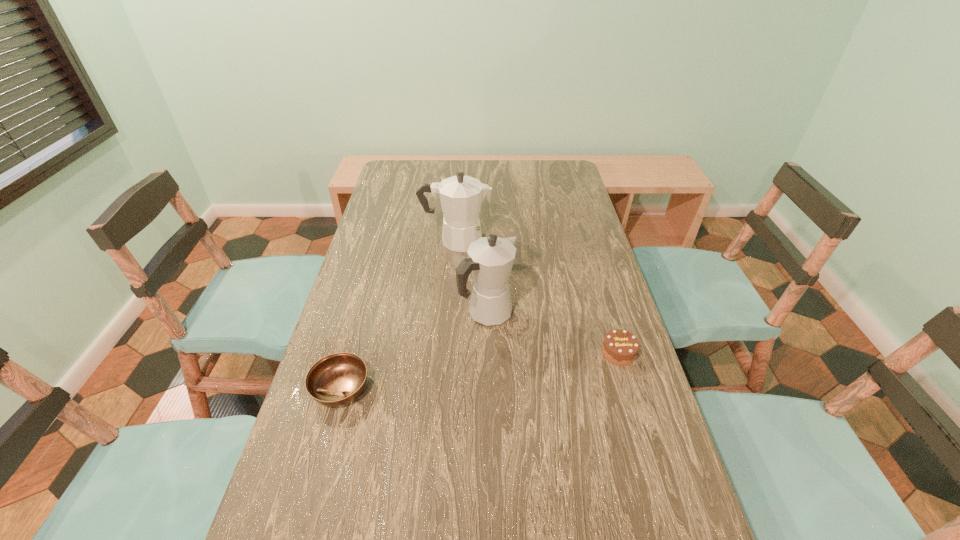
This screenshot has width=960, height=540. I want to click on free spot between the chocolate cake and the soup bowl, so click(480, 370).

Where is `empty space that is in between the rightmost object and the farthest object`? empty space that is in between the rightmost object and the farthest object is located at coordinates coord(538,296).

You are a GUI agent. You are given a task and a screenshot of the screen. Output one action in this format:
    pyautogui.click(x=<x>, y=<y>)
    Task: Click on the vacant region between the second farthest object and the leftmost object
    
    Given the screenshot: What is the action you would take?
    pyautogui.click(x=414, y=352)

The image size is (960, 540). I want to click on free spot between the shortest object and the chocolate cake, so click(x=480, y=370).

The width and height of the screenshot is (960, 540). Identify the location of blank region between the shortest object and the third tallest object. (480, 370).

Where is `free space between the leftmost object and the chocolate cake`? free space between the leftmost object and the chocolate cake is located at coordinates (480, 370).

The height and width of the screenshot is (540, 960). In order to click on vacant area between the third nearest object and the chocolate cake in this screenshot , I will do `click(553, 334)`.

What are the coordinates of `object that is the closest one to the shortest object` in the screenshot? It's located at tap(490, 259).

Point out which object is positioned as the nearest to the farthest object. Please provide its 2D coordinates. Your answer should be formatted as a tuple, i.e. [(x, y)], where the tuple contains the x and y coordinates of a point satisfying the conditions above.

[(490, 259)]

The width and height of the screenshot is (960, 540). Identify the location of vacant point that satisfies the following two spatial constraints: 1. at the spout of the farthest object; 2. on the back side of the nearer coffeepot. (450, 314).